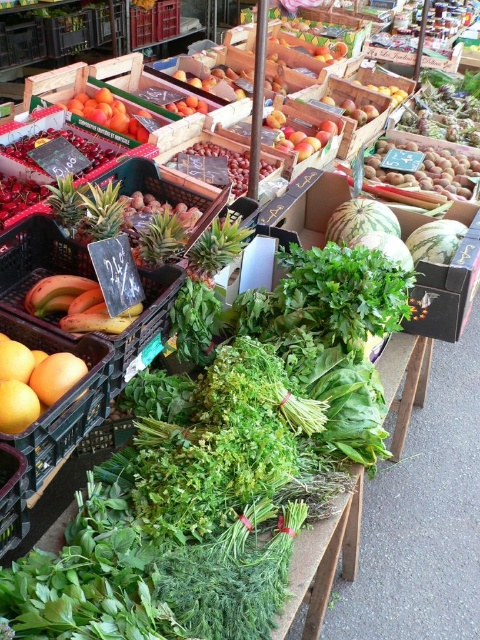
You are a customer at the market stall and want to buy both the smooth yellow grapefruit at left and the shiny red grapes at center. You need to know which one is taller to determine if they will fit in your small basket. Can you tell me which one is taller?

The shiny red grapes at center are taller than the smooth yellow grapefruit at left, so they might not both fit in your small basket if the grapes take up more vertical space.

You are a customer at the market stall and want to buy both the smooth brown nuts at upper right and the smooth orange at center. If you start from the left side of the stall, which item should you pick up first to follow the left to right order?

You should pick up the smooth orange at center first because the smooth brown nuts at upper right are to the right of the smooth orange at center, so following left to right order, the smooth orange at center comes first.